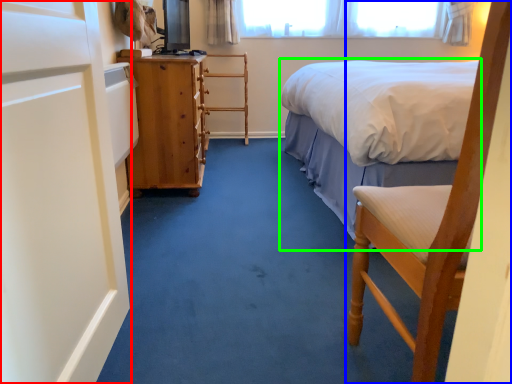
Question: Which object is the farthest from screen door (highlighted by a red box)? Choose among these: chair (highlighted by a blue box) or bed (highlighted by a green box).

Choices:
 (A) chair
 (B) bed

Answer: (B)